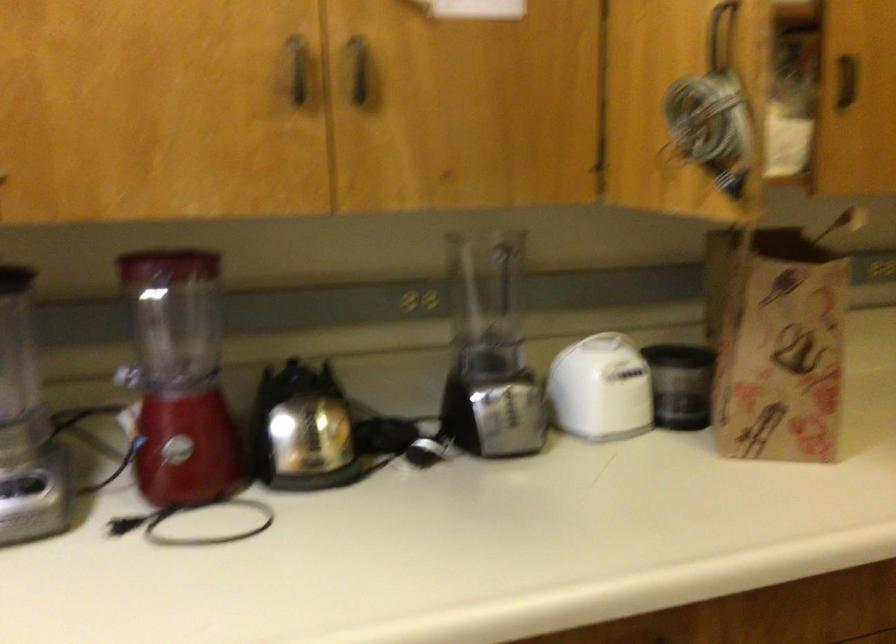
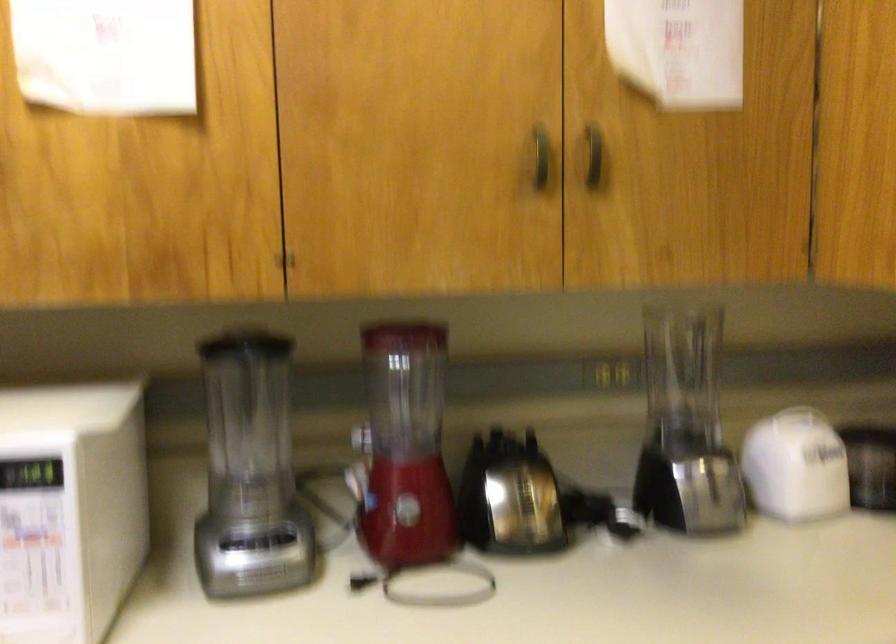
Question: The camera is either moving clockwise (left) or counter-clockwise (right) around the object. The first image is from the beginning of the video and the second image is from the end. Is the camera moving left or right when shooting the video?

Choices:
 (A) Left
 (B) Right

Answer: (B)